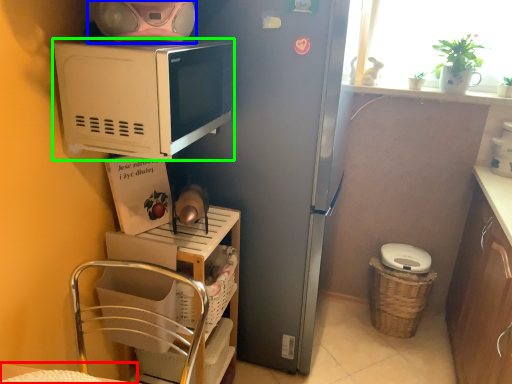
Question: Which object is positioned closest to table (highlighted by a red box)? Select from appliance (highlighted by a blue box) and microwave oven (highlighted by a green box).

Choices:
 (A) appliance
 (B) microwave oven

Answer: (B)